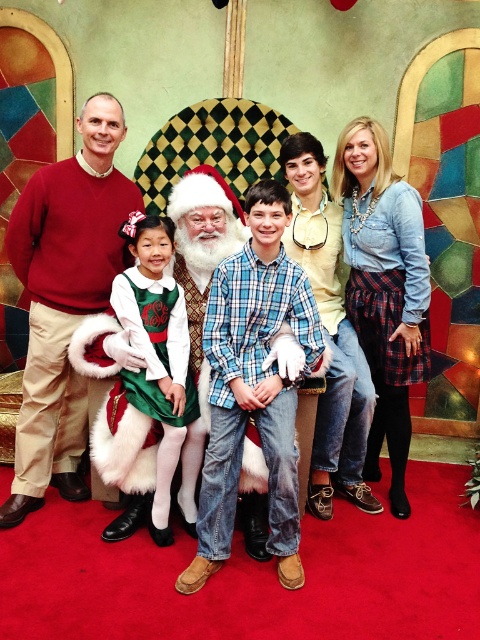
Which of these two, matte black laptop at center or red sweater at left, stands shorter?

Standing shorter between the two is matte black laptop at center.

Which is behind, point (68, 285) or point (76, 168)?

The point (68, 285) is more distant.

Is point (85, 401) closer to viewer compared to point (7, 524)?

No, it is behind (7, 524).

Image resolution: width=480 pixels, height=640 pixels. What are the coordinates of `matte black laptop at center` in the screenshot? It's located at (60, 282).

Does matte black laptop at center appear under white fluffy santa at center?

Yes, matte black laptop at center is below white fluffy santa at center.

The width and height of the screenshot is (480, 640). What do you see at coordinates (60, 282) in the screenshot?
I see `matte black laptop at center` at bounding box center [60, 282].

Which is behind, point (96, 259) or point (204, 224)?

Point (96, 259)

Locate an element on the screen. This screenshot has height=640, width=480. matte black laptop at center is located at coordinates (60, 282).

Is matte black laptop at center bigger than blue plaid shirt at center?

Correct, matte black laptop at center is larger in size than blue plaid shirt at center.

Can you confirm if matte black laptop at center is thinner than blue plaid shirt at center?

In fact, matte black laptop at center might be wider than blue plaid shirt at center.

This screenshot has width=480, height=640. I want to click on matte black laptop at center, so click(x=60, y=282).